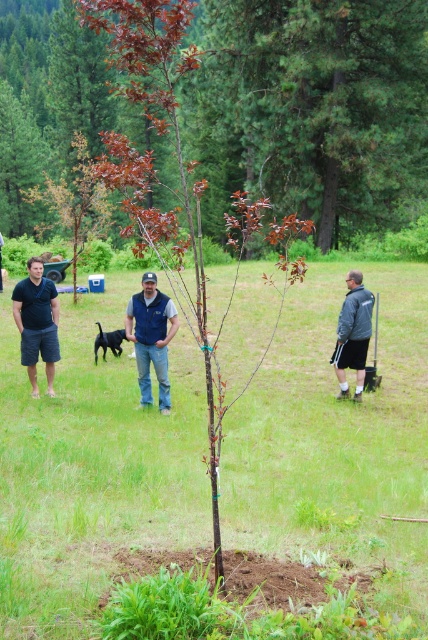
Can you confirm if blue denim jeans at center is bigger than matte black t-shirt at left?

No.

Consider the image. Between blue denim jeans at center and matte black t-shirt at left, which one has more height?

Standing taller between the two is matte black t-shirt at left.

What do you see at coordinates (151, 337) in the screenshot?
I see `blue denim jeans at center` at bounding box center [151, 337].

Identify the location of blue denim jeans at center. 151,337.

Between smooth brown tree at center and matte black t-shirt at left, which one has less height?

With less height is matte black t-shirt at left.

Can you confirm if smooth brown tree at center is positioned below matte black t-shirt at left?

No, smooth brown tree at center is not below matte black t-shirt at left.

Is point (338, 230) positioned behind point (29, 346)?

That is True.

This screenshot has width=428, height=640. What are the coordinates of `smooth brown tree at center` in the screenshot? It's located at (312, 109).

Can you confirm if smooth brown tree at center is taller than blue denim jeans at center?

Indeed, smooth brown tree at center has a greater height compared to blue denim jeans at center.

Which is below, smooth brown tree at center or blue denim jeans at center?

blue denim jeans at center

Between point (377, 204) and point (160, 321), which one is positioned in front?

Point (160, 321) is in front.

Where is `smooth brown tree at center`? smooth brown tree at center is located at coordinates (312, 109).